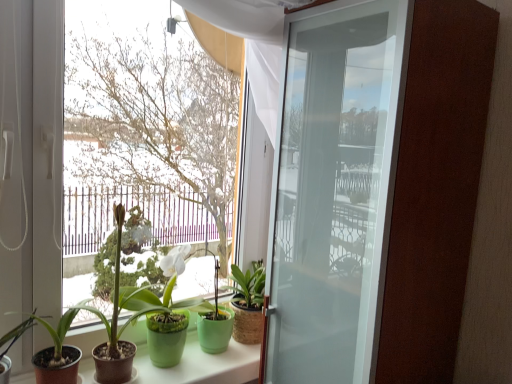
Question: Does green matte pot at center, which is the fourth houseplant from left to right, come behind green matte plant pots at lower center?

Choices:
 (A) no
 (B) yes

Answer: (B)

Question: Would you consider green matte pot at center, the second houseplant when ordered from right to left, to be distant from green matte plant pots at lower center?

Choices:
 (A) yes
 (B) no

Answer: (B)

Question: Is green matte plant pots at lower center located within green matte pot at center, the second houseplant when ordered from right to left?

Choices:
 (A) no
 (B) yes

Answer: (A)

Question: Can you confirm if green matte pot at center, the second houseplant when ordered from right to left, is taller than green matte plant pots at lower center?

Choices:
 (A) yes
 (B) no

Answer: (A)

Question: Can you confirm if green matte pot at center, which is the fourth houseplant from left to right, is smaller than green matte plant pots at lower center?

Choices:
 (A) no
 (B) yes

Answer: (B)

Question: Is green matte pot at center, the second houseplant when ordered from right to left, at the left side of green matte plant pots at lower center?

Choices:
 (A) yes
 (B) no

Answer: (A)

Question: Is frosted glass door at center thinner than green matte pot at center, the second houseplant when ordered from right to left?

Choices:
 (A) yes
 (B) no

Answer: (B)

Question: Can we say frosted glass door at center lies outside green matte pot at center, which is the fourth houseplant from left to right?

Choices:
 (A) yes
 (B) no

Answer: (A)

Question: From a real-world perspective, is frosted glass door at center under green matte pot at center, the second houseplant when ordered from right to left?

Choices:
 (A) no
 (B) yes

Answer: (A)

Question: Is frosted glass door at center at the left side of green matte pot at center, the second houseplant when ordered from right to left?

Choices:
 (A) no
 (B) yes

Answer: (A)

Question: Can you confirm if frosted glass door at center is bigger than green matte pot at center, the second houseplant when ordered from right to left?

Choices:
 (A) yes
 (B) no

Answer: (A)

Question: From the image's perspective, is frosted glass door at center located beneath green matte pot at center, the second houseplant when ordered from right to left?

Choices:
 (A) no
 (B) yes

Answer: (A)

Question: Is burlap-textured plant pot at center, which appears as the fifth houseplant when viewed from the left, in contact with green matte pot at center, the second houseplant when ordered from right to left?

Choices:
 (A) yes
 (B) no

Answer: (B)